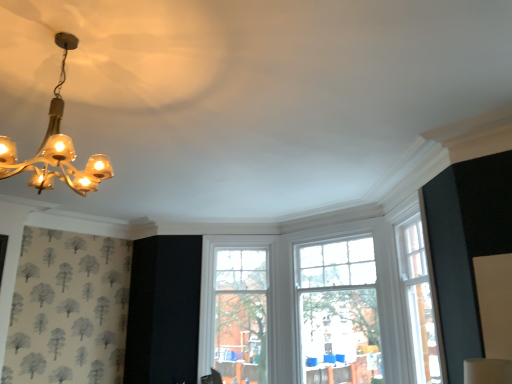
Question: Considering the positions of gold glass chandelier at upper left and clear glass window at center, which ranks as the 1th window in left-to-right order, in the image, is gold glass chandelier at upper left taller or shorter than clear glass window at center, which ranks as the 1th window in left-to-right order,?

Choices:
 (A) short
 (B) tall

Answer: (A)

Question: Relative to clear glass window at center, which ranks as the 1th window in left-to-right order, is gold glass chandelier at upper left in front or behind?

Choices:
 (A) front
 (B) behind

Answer: (A)

Question: Which is nearer to the clear glass window at center, the second window positioned from the left?

Choices:
 (A) gold glass chandelier at upper left
 (B) clear glass window at center, which ranks as the 1th window in left-to-right order

Answer: (B)

Question: Estimate the real-world distances between objects in this image. Which object is farther from the clear glass window at center, the second window positioned from the right?

Choices:
 (A) clear glass window at center, the second window positioned from the left
 (B) gold glass chandelier at upper left

Answer: (B)